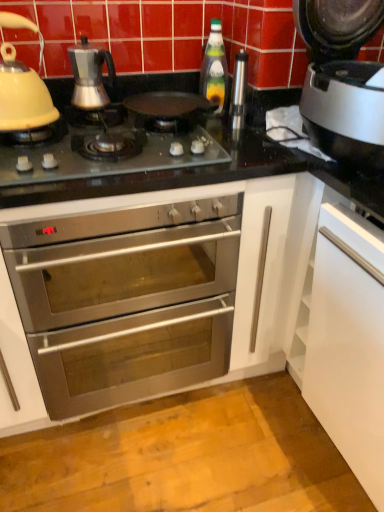
Question: From their relative heights in the image, would you say white glossy dishwasher at lower right, the second appliance viewed from the top, is taller or shorter than green glass bottle at center?

Choices:
 (A) tall
 (B) short

Answer: (A)

Question: In terms of width, does white glossy dishwasher at lower right, the second appliance viewed from the top, look wider or thinner when compared to green glass bottle at center?

Choices:
 (A) wide
 (B) thin

Answer: (A)

Question: Considering the real-world distances, which object is farthest from the green glass bottle at center?

Choices:
 (A) stainless steel oven at center
 (B) matte yellow kettle at left, the first kitchen appliance when ordered from left to right
 (C) satin silver coffee maker at upper left, which is counted as the first kitchen appliance, starting from the right
 (D) white glossy dishwasher at lower right, the second appliance viewed from the top
 (E) black glass gas stove at center

Answer: (D)

Question: Considering the real-world distances, which object is closest to the matte yellow kettle at left, placed as the second kitchen appliance when sorted from right to left?

Choices:
 (A) stainless steel oven at center
 (B) white glossy dishwasher at lower right, marked as the 1th appliance in a right-to-left arrangement
 (C) green glass bottle at center
 (D) satin silver coffee maker at upper left, which is counted as the first kitchen appliance, starting from the right
 (E) satin silver thermos at upper right, which ranks as the 1th appliance in left-to-right order

Answer: (D)